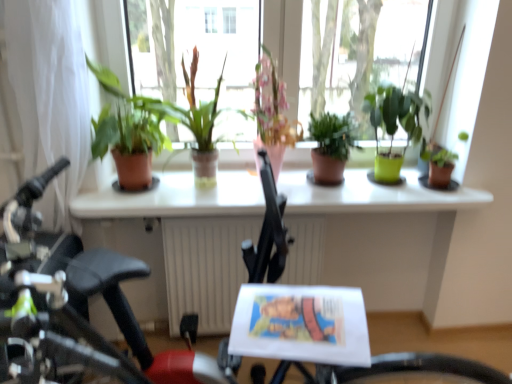
Question: From a real-world perspective, relative to white sheer curtain at left, is white glossy table at center vertically above or below?

Choices:
 (A) above
 (B) below

Answer: (B)

Question: From their relative heights in the image, would you say white glossy table at center is taller or shorter than white sheer curtain at left?

Choices:
 (A) tall
 (B) short

Answer: (B)

Question: Which object is the closest to the green matte plant at center, which appears as the second houseplant when viewed from the right?

Choices:
 (A) pink ceramic vase at center, the 3th houseplant when ordered from left to right
 (B) white glossy window sill at center
 (C) green matte plant at center, arranged as the third houseplant when viewed from the right
 (D) terracotta pot at center, which ranks as the 5th houseplant in right-to-left order
 (E) white sheer curtain at left

Answer: (C)

Question: Which object is the closest to the terracotta pot at center, which ranks as the 5th houseplant in right-to-left order?

Choices:
 (A) white sheer curtain at left
 (B) green matte plant at center, which appears as the second houseplant when viewed from the right
 (C) white glossy table at center
 (D) matte terracotta pot at left, which appears as the first houseplant when viewed from the left
 (E) green matte plant at right, positioned as the 1th houseplant in right-to-left order

Answer: (D)